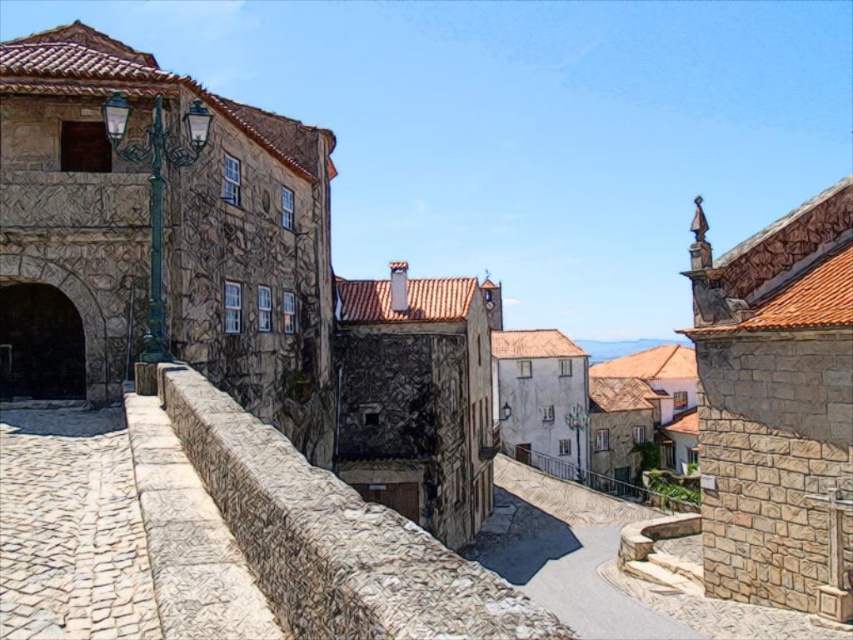
Is rustic stone ledge at center closer to camera compared to stone paved path at center?

Yes.

Is rustic stone ledge at center bigger than stone paved path at center?

Yes, rustic stone ledge at center is bigger than stone paved path at center.

The width and height of the screenshot is (853, 640). What are the coordinates of `rustic stone ledge at center` in the screenshot? It's located at (334, 538).